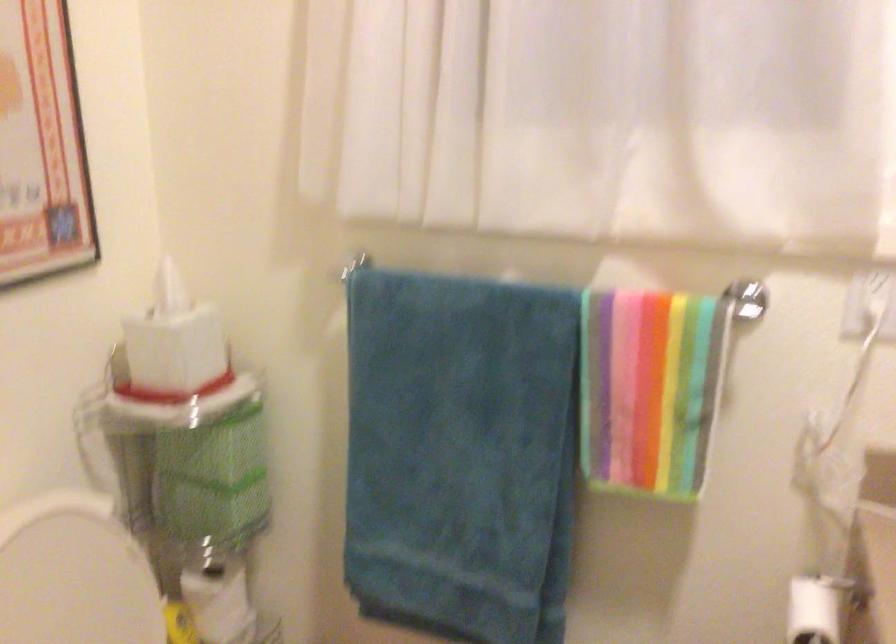
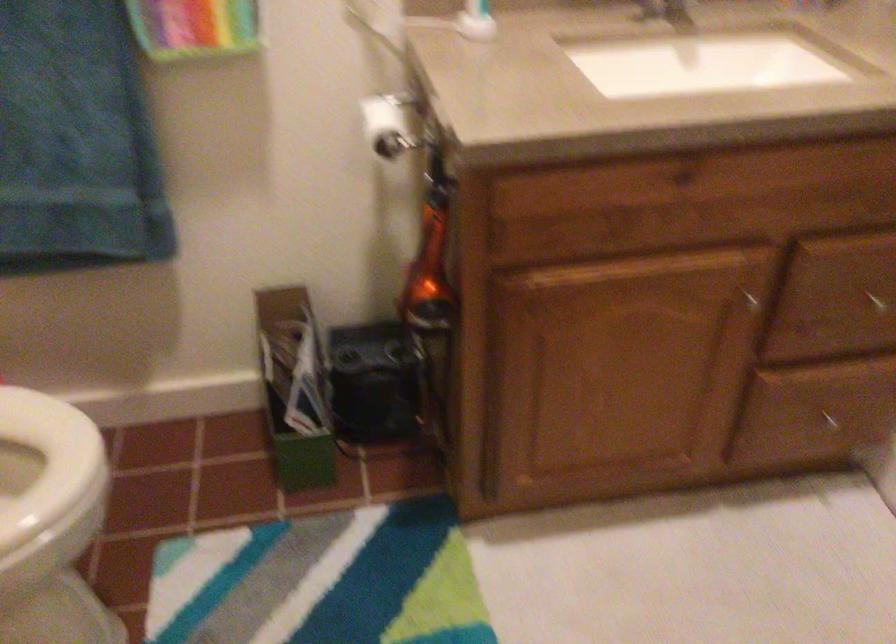
How did the camera likely rotate?

The rotation direction of the camera is right-down.